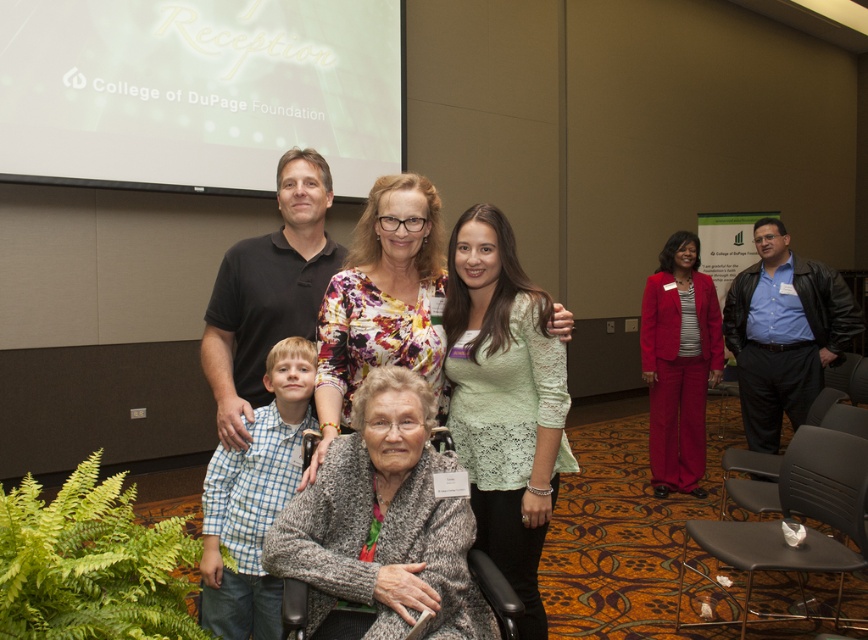
You are a photographer at the College of DuPage Foundation reception. You need to ensure that all clothing items in the photo are visible. The gray knitted sweater at center and the lace fabric sweater at center are both in the frame. Which sweater should you adjust to make sure both are fully visible?

The gray knitted sweater at center has a lesser height compared to lace fabric sweater at center. To ensure both are fully visible, you should adjust the gray knitted sweater at center to a higher position so it aligns with the lace fabric sweater at center.

You are a photographer at the College of DuPage Foundation reception. You need to determine which of the two center items, the lace fabric sweater at center or the floral fabric blouse at center, is smaller in size. Which one should you choose?

The lace fabric sweater at center is smaller than the floral fabric blouse at center, so you should choose the lace fabric sweater at center.